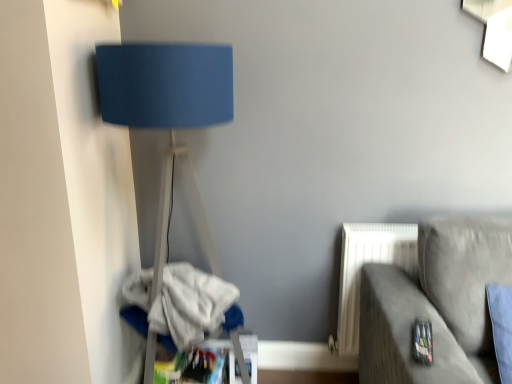
Question: From the image's perspective, would you say matte blue lampshade at left is positioned over suede gray couch at lower right?

Choices:
 (A) no
 (B) yes

Answer: (B)

Question: Considering the relative sizes of matte blue lampshade at left and suede gray couch at lower right in the image provided, is matte blue lampshade at left taller than suede gray couch at lower right?

Choices:
 (A) no
 (B) yes

Answer: (B)

Question: From the image's perspective, is matte blue lampshade at left below suede gray couch at lower right?

Choices:
 (A) yes
 (B) no

Answer: (B)

Question: Is suede gray couch at lower right inside matte blue lampshade at left?

Choices:
 (A) no
 (B) yes

Answer: (A)

Question: Is matte blue lampshade at left next to suede gray couch at lower right and touching it?

Choices:
 (A) yes
 (B) no

Answer: (B)

Question: Is matte blue lampshade at left to the left or to the right of white cotton laundry at lower left in the image?

Choices:
 (A) right
 (B) left

Answer: (A)

Question: Based on their sizes in the image, would you say matte blue lampshade at left is bigger or smaller than white cotton laundry at lower left?

Choices:
 (A) big
 (B) small

Answer: (A)

Question: From the image's perspective, is matte blue lampshade at left located above or below white cotton laundry at lower left?

Choices:
 (A) below
 (B) above

Answer: (B)

Question: From a real-world perspective, is matte blue lampshade at left physically located above or below white cotton laundry at lower left?

Choices:
 (A) above
 (B) below

Answer: (A)

Question: In terms of height, does suede gray couch at lower right look taller or shorter compared to white cotton laundry at lower left?

Choices:
 (A) short
 (B) tall

Answer: (B)

Question: From the image's perspective, is suede gray couch at lower right positioned above or below white cotton laundry at lower left?

Choices:
 (A) above
 (B) below

Answer: (B)

Question: Looking at the image, does suede gray couch at lower right seem bigger or smaller compared to white cotton laundry at lower left?

Choices:
 (A) small
 (B) big

Answer: (B)

Question: Considering the positions of point (454, 345) and point (172, 345), is point (454, 345) closer or farther from the camera than point (172, 345)?

Choices:
 (A) closer
 (B) farther

Answer: (A)

Question: Considering the positions of white cotton laundry at lower left and suede gray couch at lower right in the image, is white cotton laundry at lower left bigger or smaller than suede gray couch at lower right?

Choices:
 (A) small
 (B) big

Answer: (A)

Question: Is white cotton laundry at lower left wider or thinner than suede gray couch at lower right?

Choices:
 (A) thin
 (B) wide

Answer: (A)